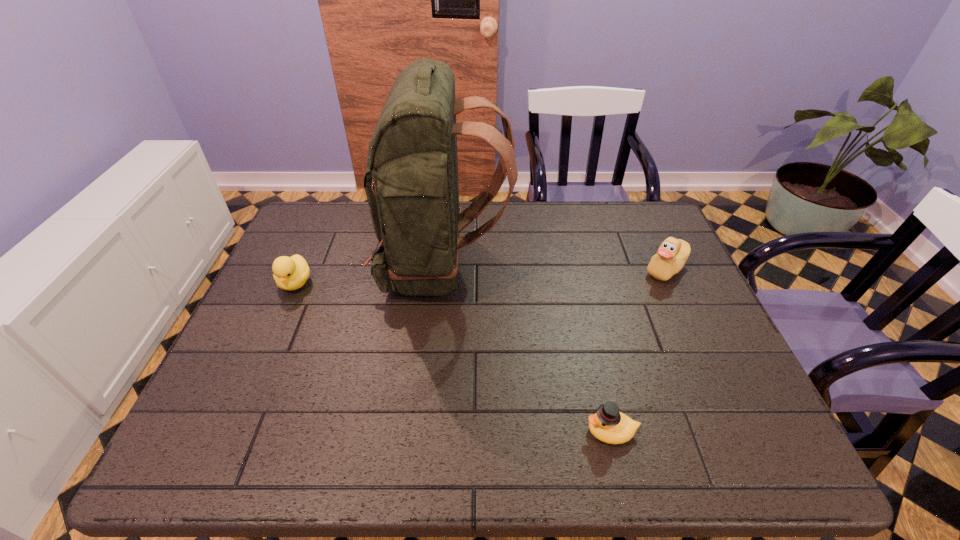
Where is `vacant space that satisfies the following two spatial constraints: 1. at the beak of the rightmost duck; 2. on the front-facing side of the leftmost duck`? vacant space that satisfies the following two spatial constraints: 1. at the beak of the rightmost duck; 2. on the front-facing side of the leftmost duck is located at coordinates (672, 283).